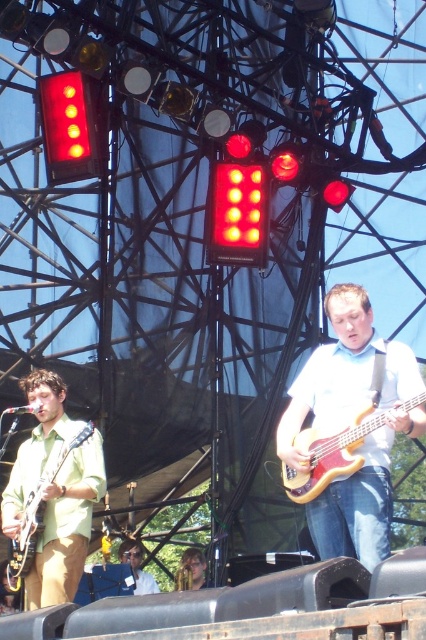
Is wooden electric bass at center shorter than light brown leather jacket at center?

Incorrect, wooden electric bass at center's height does not fall short of light brown leather jacket at center's.

Between wooden electric bass at center and light brown leather jacket at center, which one is positioned higher?

wooden electric bass at center

Who is more distant from viewer, (342, 456) or (134, 550)?

The point (134, 550) is behind.

The height and width of the screenshot is (640, 426). In order to click on wooden electric bass at center in this screenshot , I will do `click(331, 452)`.

Does wooden electric bass at center have a greater width compared to matte green wood guitar at left?

Correct, the width of wooden electric bass at center exceeds that of matte green wood guitar at left.

Can you confirm if wooden electric bass at center is positioned above matte green wood guitar at left?

Indeed, wooden electric bass at center is positioned over matte green wood guitar at left.

Does point (360, 465) lie in front of point (37, 484)?

Yes, point (360, 465) is closer to viewer.

This screenshot has width=426, height=640. I want to click on wooden electric bass at center, so click(x=331, y=452).

Does point (406, 355) come behind point (311, 497)?

Yes, it is.

Which is behind, point (353, 300) or point (319, 429)?

The point (353, 300) is more distant.

Between point (382, 552) and point (313, 480), which one is positioned in front?

Positioned in front is point (382, 552).

This screenshot has width=426, height=640. Identify the location of matte white shirt at center. (370, 474).